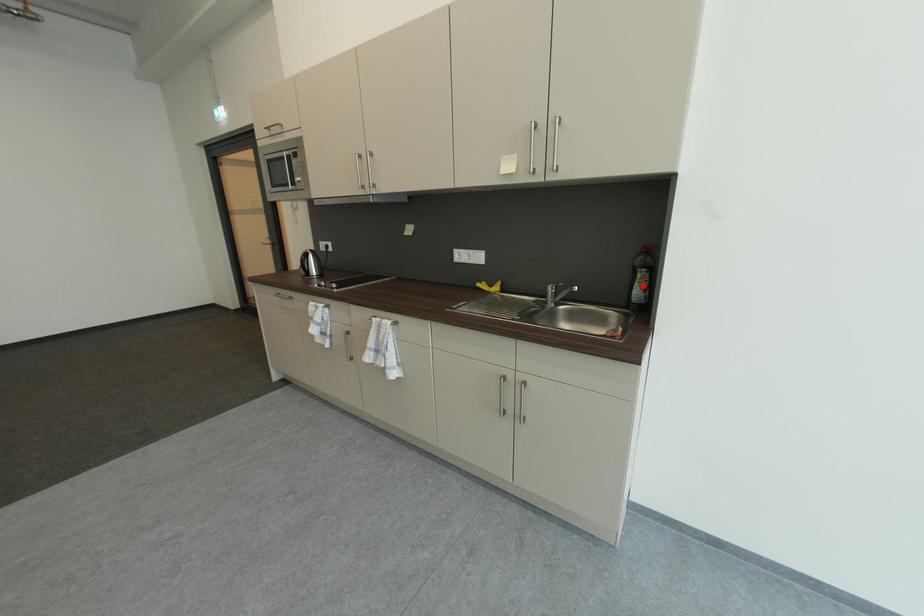
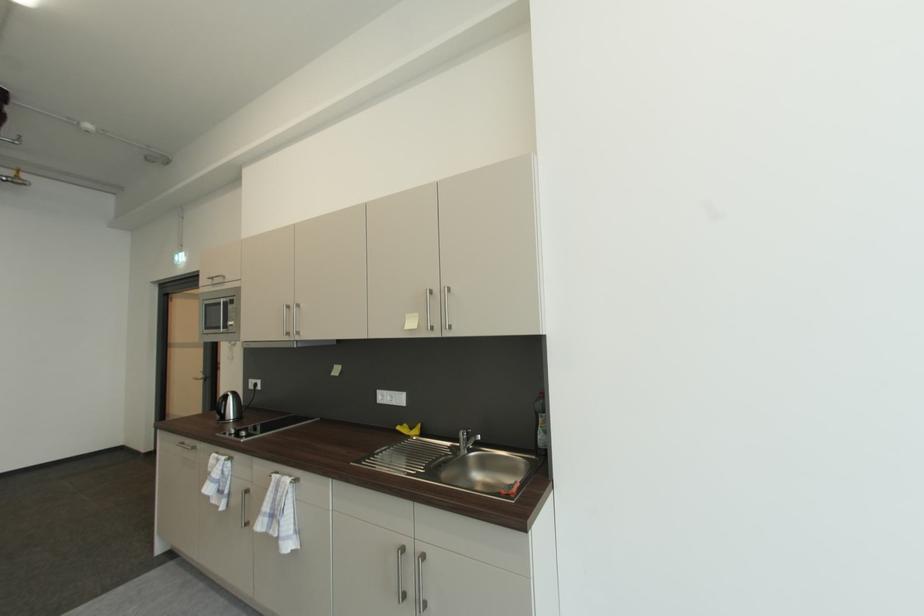
Find the pixel in the second image that matches the highlighted location in the first image.

(545, 430)